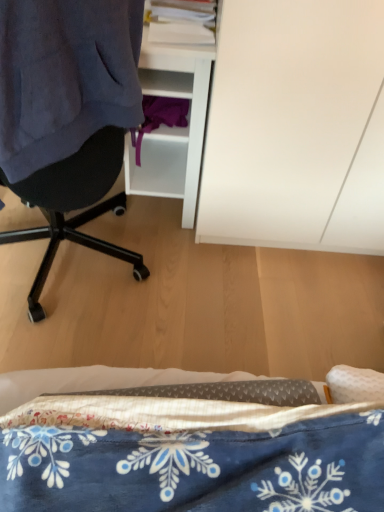
The width and height of the screenshot is (384, 512). Find the location of `dark blue fabric at left`. dark blue fabric at left is located at coordinates (65, 77).

The height and width of the screenshot is (512, 384). Find the location of `dark blue fabric at left`. dark blue fabric at left is located at coordinates [x=65, y=77].

In the image, there is a blue printed fabric at lower center. Where is `clothing above it (from the image's perspective)`? The image size is (384, 512). clothing above it (from the image's perspective) is located at coordinates (65, 77).

Between blue printed fabric at lower center and dark blue fabric at left, which one has less height?

blue printed fabric at lower center is shorter.

From the image's perspective, relative to dark blue fabric at left, is blue printed fabric at lower center above or below?

From the image's perspective, blue printed fabric at lower center appears below dark blue fabric at left.

Looking at this image, is white matte cabinet at upper right smaller than dark blue fabric at left?

No, white matte cabinet at upper right is not smaller than dark blue fabric at left.

Which point is more distant from viewer, (335, 30) or (19, 42)?

The point (335, 30) is farther.

Considering the relative positions of white matte cabinet at upper right and dark blue fabric at left in the image provided, is white matte cabinet at upper right in front of dark blue fabric at left?

No, it is behind dark blue fabric at left.

Visually, is white matte cabinet at upper right positioned to the left or to the right of blue printed fabric at lower center?

In the image, white matte cabinet at upper right appears on the right side of blue printed fabric at lower center.

In terms of size, does white matte cabinet at upper right appear bigger or smaller than blue printed fabric at lower center?

white matte cabinet at upper right is bigger than blue printed fabric at lower center.

Which of these two, white matte cabinet at upper right or blue printed fabric at lower center, stands taller?

With more height is white matte cabinet at upper right.

Would you consider white matte cabinet at upper right to be distant from blue printed fabric at lower center?

Actually, white matte cabinet at upper right and blue printed fabric at lower center are a little close together.

Does dark blue fabric at left appear on the right side of white matte cabinet at upper right?

No.

Considering the points (116, 74) and (196, 240), which point is in front, point (116, 74) or point (196, 240)?

Point (116, 74)

Which of these two, dark blue fabric at left or white matte cabinet at upper right, stands taller?

Answer: white matte cabinet at upper right.

Choose the correct answer: Is dark blue fabric at left inside white matte cabinet at upper right or outside it?

The correct answer is: outside.

Could blue printed fabric at lower center be considered to be inside dark blue fabric at left?

Actually, blue printed fabric at lower center is outside dark blue fabric at left.

Is dark blue fabric at left positioned with its back to blue printed fabric at lower center?

Absolutely, dark blue fabric at left is directed away from blue printed fabric at lower center.

Based on their sizes in the image, would you say dark blue fabric at left is bigger or smaller than blue printed fabric at lower center?

Considering their sizes, dark blue fabric at left takes up more space than blue printed fabric at lower center.

Which is in front, point (41, 61) or point (364, 417)?

The point (364, 417) is closer to the camera.

Between point (94, 456) and point (320, 176), which one is positioned in front?

Positioned in front is point (94, 456).

Is blue printed fabric at lower center to the left of white matte cabinet at upper right from the viewer's perspective?

Yes.

In order to click on bed that is in front of the white matte cabinet at upper right in this screenshot , I will do `click(193, 450)`.

From a real-world perspective, which is physically above, blue printed fabric at lower center or white matte cabinet at upper right?

white matte cabinet at upper right is physically above.

This screenshot has height=512, width=384. In order to click on clothing lying on the left of blue printed fabric at lower center in this screenshot , I will do `click(65, 77)`.

The height and width of the screenshot is (512, 384). Identify the location of cabinetry above the dark blue fabric at left (from the image's perspective). (296, 127).

Estimate the real-world distances between objects in this image. Which object is further from blue printed fabric at lower center, white matte cabinet at upper right or dark blue fabric at left?

white matte cabinet at upper right is further to blue printed fabric at lower center.

From the image, which object appears to be farther from white matte cabinet at upper right, blue printed fabric at lower center or dark blue fabric at left?

blue printed fabric at lower center lies further to white matte cabinet at upper right than the other object.

From the image, which object appears to be nearer to dark blue fabric at left, blue printed fabric at lower center or white matte cabinet at upper right?

white matte cabinet at upper right is positioned closer to the anchor dark blue fabric at left.

Considering their positions, is dark blue fabric at left positioned further to white matte cabinet at upper right than blue printed fabric at lower center?

Among the two, blue printed fabric at lower center is located further to white matte cabinet at upper right.

From the image, which object appears to be farther from blue printed fabric at lower center, dark blue fabric at left or white matte cabinet at upper right?

white matte cabinet at upper right.

Looking at the image, which one is located closer to dark blue fabric at left, white matte cabinet at upper right or blue printed fabric at lower center?

white matte cabinet at upper right is positioned closer to the anchor dark blue fabric at left.

Identify the location of clothing that lies between white matte cabinet at upper right and blue printed fabric at lower center from top to bottom. This screenshot has width=384, height=512. (65, 77).